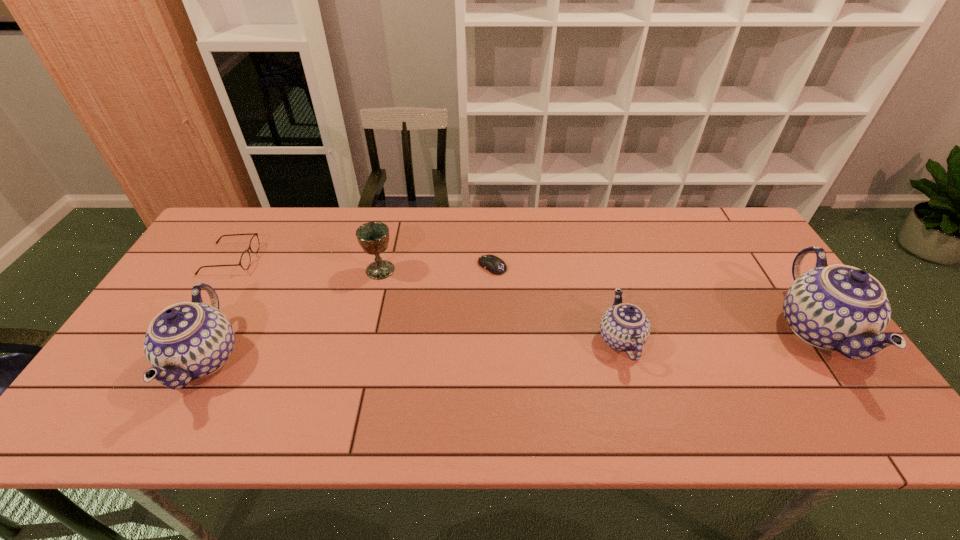
The height and width of the screenshot is (540, 960). I want to click on vacant area situated 0.110m at the spout of the leftmost chinaware, so click(x=123, y=360).

This screenshot has height=540, width=960. Find the location of `blank area located 0.100m at the spout of the leftmost chinaware`. blank area located 0.100m at the spout of the leftmost chinaware is located at coordinates (127, 360).

Find the location of a particular element. The height and width of the screenshot is (540, 960). vacant space situated 0.190m at the spout of the shortest chinaware is located at coordinates coord(718,340).

Where is `vacant region located 0.190m at the spout of the rightmost chinaware`? This screenshot has height=540, width=960. vacant region located 0.190m at the spout of the rightmost chinaware is located at coordinates (705, 330).

At what (x,y) coordinates should I click in order to perform the action: click on vacant space located 0.090m at the spout of the rightmost chinaware. Please return your answer as a coordinate pair (x, y). This screenshot has width=960, height=540. Looking at the image, I should click on [x=743, y=330].

Locate an element on the screen. Image resolution: width=960 pixels, height=540 pixels. blank area located at the spout of the rightmost chinaware is located at coordinates (755, 330).

Identify the location of blank space located on the front-facing side of the spectacles. The width and height of the screenshot is (960, 540). (385, 259).

You are a GUI agent. You are given a task and a screenshot of the screen. Output one action in this format:
    pyautogui.click(x=<x>, y=<y>)
    Task: Click on the blank space located on the right of the third object from right to left
    
    Given the screenshot: What is the action you would take?
    pyautogui.click(x=553, y=266)

Identify the location of vacant space located 0.290m on the left of the fourth shortest object. (268, 270).

This screenshot has height=540, width=960. What are the coordinates of `object positioned at the far edge` in the screenshot? It's located at (245, 260).